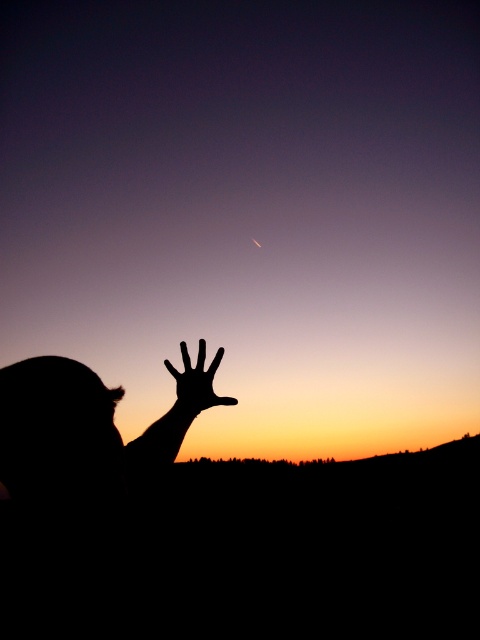
You are an astronomer observing the twilight scene. You notice the black matte hand at upper center and the silvery reflective moon at center. Which object in the scene is bigger?

The black matte hand at upper center is larger in size than the silvery reflective moon at center.

You are an astronomer analyzing the twilight scene. You notice two points of light in the sky, one at coordinates point (176, 371) and another at point (260, 248). Based on their positions, which point is closer to the observer?

Point (176, 371) is in front of point (260, 248), so it is closer to the observer.

You are an astronomer observing the twilight scene. You notice the black matte hand at upper center and the silvery reflective moon at center. Which object is positioned to the left in the image?

The black matte hand at upper center is positioned to the left of the silvery reflective moon at center.